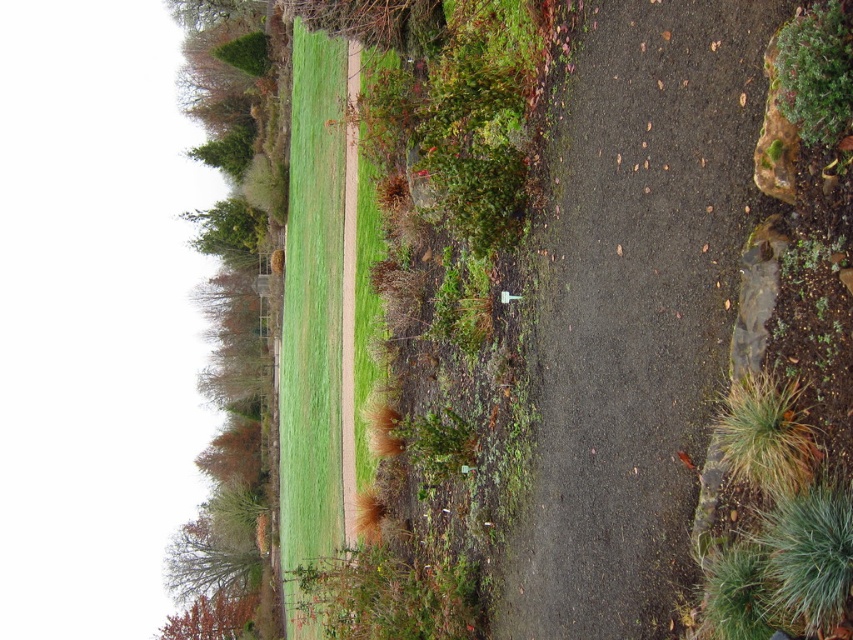
Question: Is green grass at center positioned behind brown fuzzy grass at lower right?

Choices:
 (A) yes
 (B) no

Answer: (A)

Question: Can you confirm if green grass at center is positioned above brown fuzzy grass at lower right?

Choices:
 (A) yes
 (B) no

Answer: (A)

Question: Which of the following is the farthest from the observer?

Choices:
 (A) (735, 394)
 (B) (294, 262)

Answer: (B)

Question: Which point is closer to the camera taking this photo?

Choices:
 (A) (730, 413)
 (B) (287, 595)

Answer: (A)

Question: Can you confirm if green grass at center is positioned to the right of brown fuzzy grass at lower right?

Choices:
 (A) yes
 (B) no

Answer: (B)